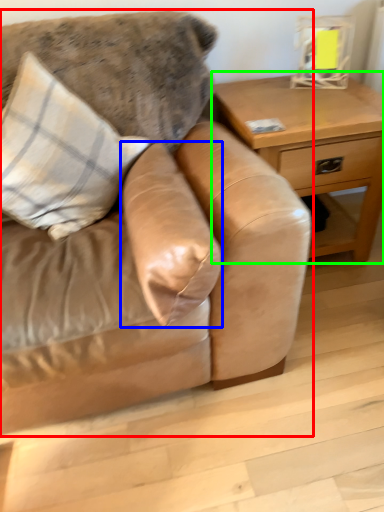
Question: Estimate the real-world distances between objects in this image. Which object is farther from studio couch (highlighted by a red box), pillow (highlighted by a blue box) or table (highlighted by a green box)?

Choices:
 (A) pillow
 (B) table

Answer: (B)